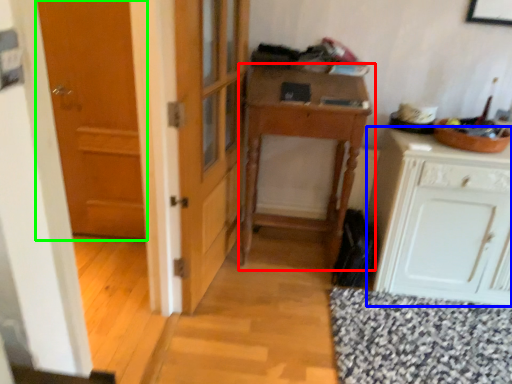
Question: Which object is positioned farthest from table (highlighted by a red box)? Select from cabinetry (highlighted by a blue box) and door (highlighted by a green box).

Choices:
 (A) cabinetry
 (B) door

Answer: (B)